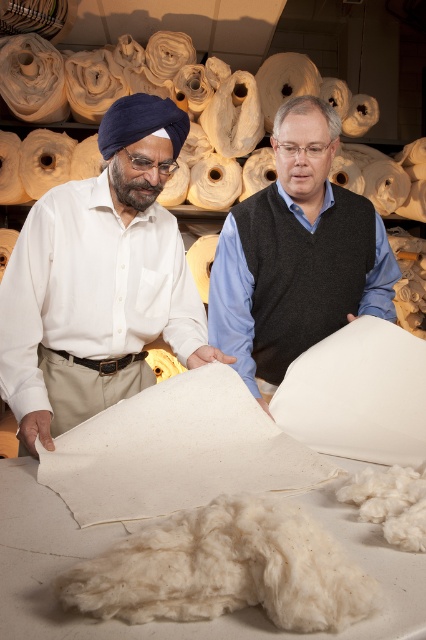
How distant is white matte fabric at left from matte white fabric at center?

white matte fabric at left and matte white fabric at center are 13.63 inches apart from each other.

Between point (62, 368) and point (386, 288), which one is positioned in front?

Point (62, 368)

The image size is (426, 640). Describe the element at coordinates (100, 280) in the screenshot. I see `white matte fabric at left` at that location.

The height and width of the screenshot is (640, 426). What are the coordinates of `white matte fabric at left` in the screenshot? It's located at (100, 280).